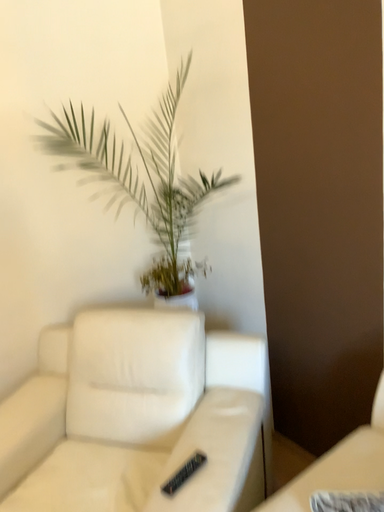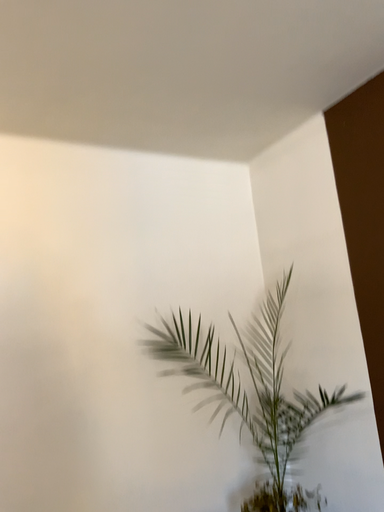
Question: Which way did the camera rotate in the video?

Choices:
 (A) rotated upward
 (B) rotated downward

Answer: (A)